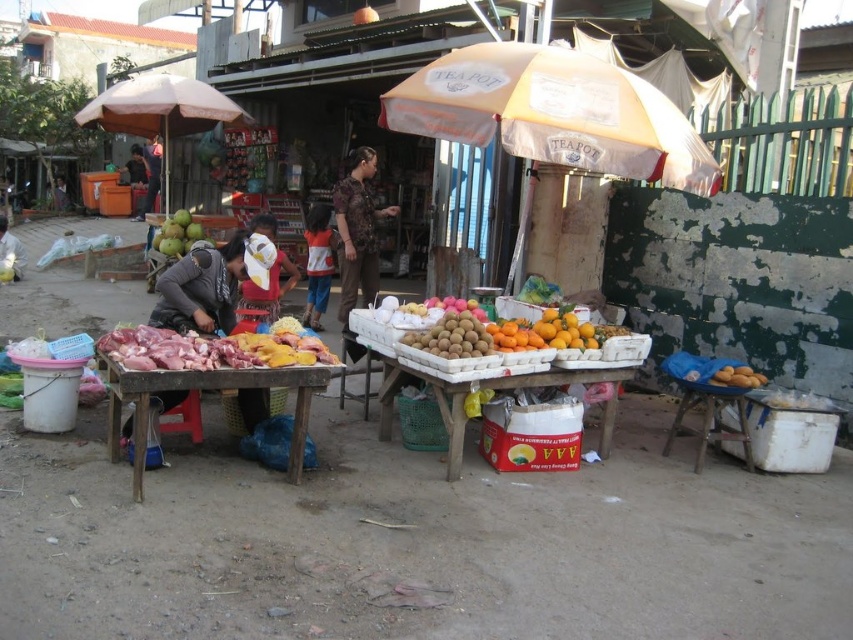
Question: Which object is positioned farthest from the matte gray jacket at center?

Choices:
 (A) green matte coconuts at center
 (B) orange matte at center
 (C) wooden table at lower left
 (D) brown textured shirt at center

Answer: (A)

Question: From the image, what is the correct spatial relationship of white cotton shirt at center in relation to green matte coconuts at center?

Choices:
 (A) right
 (B) left

Answer: (A)

Question: Does matte gray jacket at center come behind yellow matte potatoes at lower right?

Choices:
 (A) yes
 (B) no

Answer: (A)

Question: Which object is farther from the camera taking this photo?

Choices:
 (A) smooth white table at center
 (B) green matte coconuts at center
 (C) wooden table at lower left
 (D) orange matte at center

Answer: (B)

Question: Which point is farther to the camera?

Choices:
 (A) (479, 342)
 (B) (167, 288)
 (C) (184, 100)

Answer: (C)

Question: Can you confirm if wooden table at lower left is positioned below green matte coconuts at center?

Choices:
 (A) yes
 (B) no

Answer: (A)